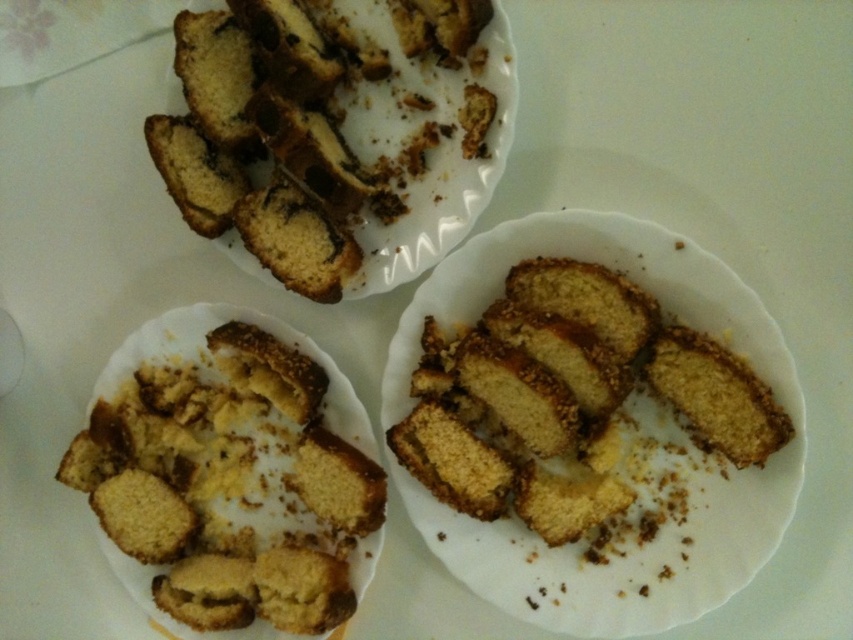
You are at a bakery counter and want to grab the golden crumbly muffin at lower left. However, there is a white matte plate at center in the way. Can you reach the muffin without moving the plate?

The golden crumbly muffin at lower left is closer to you than the white matte plate at center, so yes, you can reach it without moving the plate.

You are a food critic standing in front of the table with the golden crumbly muffin at lower left and the golden crumbly cake at center. You want to take a bite from the one closer to you. Which dessert should you choose?

The golden crumbly muffin at lower left is closer to you than the golden crumbly cake at center, so you should choose the golden crumbly muffin at lower left.

You are a food critic standing in front of a dessert display. You see the white matte plate at center and the golden crumbly cake at center. Which object is closer to you?

The white matte plate at center is closer to you than the golden crumbly cake at center.